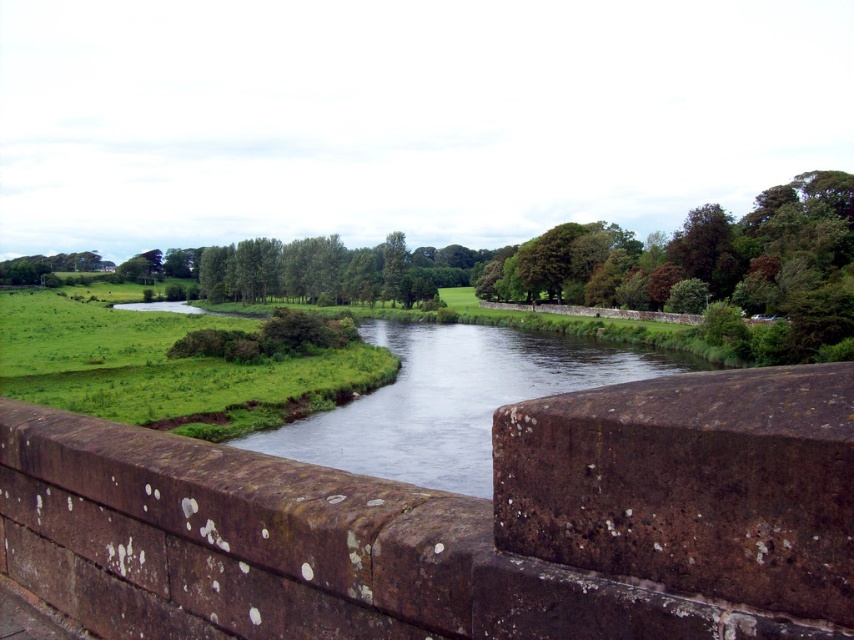
Question: Can you confirm if brown stone ledge at center is smaller than clear water at center?

Choices:
 (A) no
 (B) yes

Answer: (B)

Question: Can you confirm if brown stone ledge at center is positioned to the right of clear water at center?

Choices:
 (A) yes
 (B) no

Answer: (B)

Question: Can you confirm if brown stone ledge at center is positioned to the right of clear water at center?

Choices:
 (A) no
 (B) yes

Answer: (A)

Question: Among these objects, which one is farthest from the camera?

Choices:
 (A) clear water at center
 (B) brown stone ledge at center

Answer: (A)

Question: Which object is farther from the camera taking this photo?

Choices:
 (A) clear water at center
 (B) brown stone ledge at center

Answer: (A)